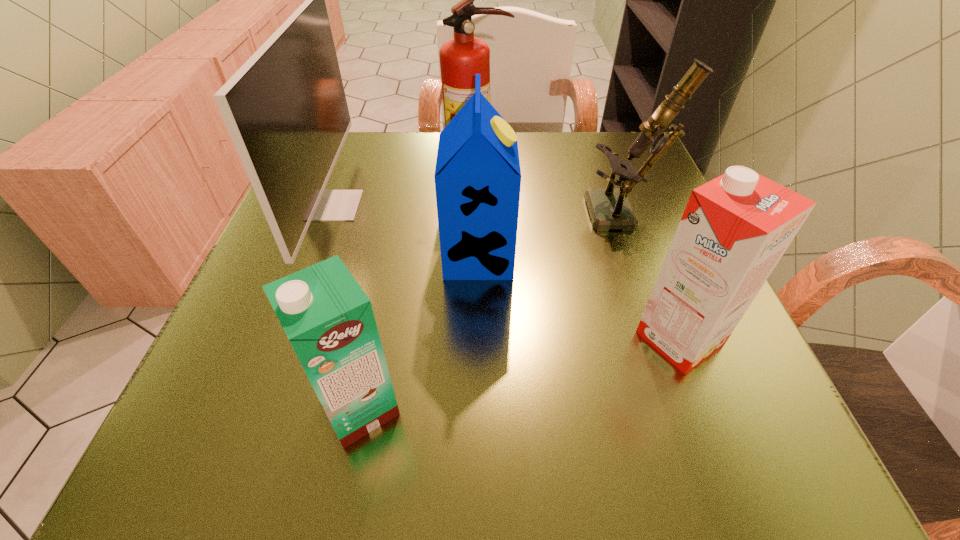
What are the coordinates of `unoccupied area between the second carton from right to left and the monitor` in the screenshot? It's located at (405, 231).

Find the location of a particular element. Image resolution: width=960 pixels, height=540 pixels. free spot between the monitor and the fire extinguisher is located at coordinates (405, 189).

Where is `free space between the monitor and the farthest carton`? This screenshot has width=960, height=540. free space between the monitor and the farthest carton is located at coordinates (405, 231).

Identify which object is located as the third nearest to the leftmost carton. Please provide its 2D coordinates. Your answer should be formatted as a tuple, i.e. [(x, y)], where the tuple contains the x and y coordinates of a point satisfying the conditions above.

[(735, 228)]

Locate which object ranks third in proximity to the leftmost carton. Please provide its 2D coordinates. Your answer should be formatted as a tuple, i.e. [(x, y)], where the tuple contains the x and y coordinates of a point satisfying the conditions above.

[(735, 228)]

Locate an element on the screen. the second closest carton to the leftmost carton is located at coordinates (735, 228).

You are a GUI agent. You are given a task and a screenshot of the screen. Output one action in this format:
    pyautogui.click(x=<x>, y=<y>)
    Task: Click on the second closest carton relative to the monitor
    
    Given the screenshot: What is the action you would take?
    pyautogui.click(x=477, y=176)

At what (x,y) coordinates should I click in order to perform the action: click on free point that satisfies the following two spatial constraints: 1. at the eyepiece of the microscope; 2. on the front side of the fifth object from right to left. Please return your answer as a coordinate pair (x, y). The height and width of the screenshot is (540, 960). Looking at the image, I should click on (697, 407).

What are the coordinates of `free space that satisfies the following two spatial constraints: 1. with the cap open on the farthest carton; 2. on the back side of the rightmost carton` in the screenshot? It's located at (478, 338).

Find the location of a particular element. free space that satisfies the following two spatial constraints: 1. on the front-facing side of the leftmost object; 2. on the left side of the leftmost carton is located at coordinates (x=255, y=407).